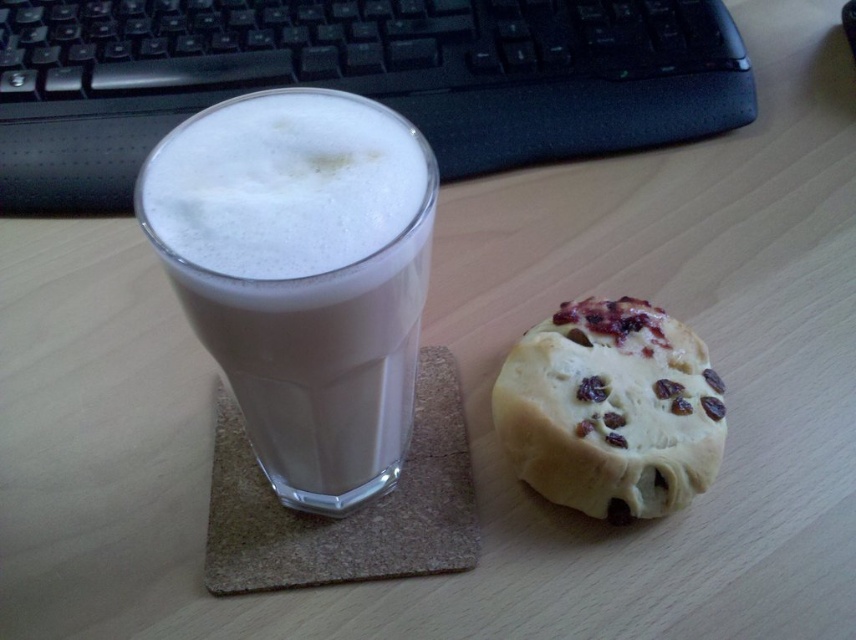
You are organizing items on a desk and need to place a new item between the black plastic keyboard at upper center and the golden crumbly biscuit at right. Which side of the keyboard should you place the item to ensure it fits between them?

The black plastic keyboard at upper center is bigger than the golden crumbly biscuit at right, so placing the new item closer to the biscuit side of the keyboard would ensure it fits between them.

You are a robotic arm that needs to pick up the golden crumbly biscuit at right without touching the black plastic keyboard at upper center. Can you do it?

Result: The distance between the black plastic keyboard at upper center and golden crumbly biscuit at right is 17.06 inches, so yes, the robotic arm can reach the golden crumbly biscuit at right without touching the black plastic keyboard at upper center.